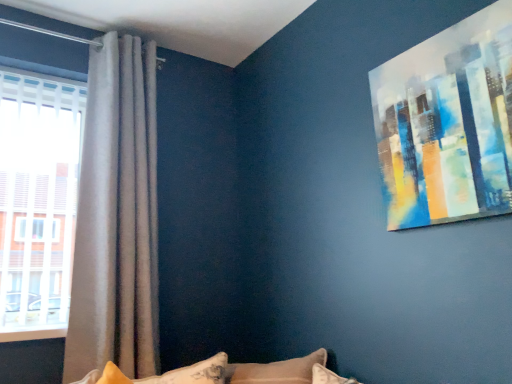
Question: Considering the relative sizes of satin grey curtain at left and fluffy white pillow at lower center in the image provided, is satin grey curtain at left shorter than fluffy white pillow at lower center?

Choices:
 (A) yes
 (B) no

Answer: (B)

Question: Does satin grey curtain at left come behind fluffy white pillow at lower center?

Choices:
 (A) yes
 (B) no

Answer: (A)

Question: From a real-world perspective, is satin grey curtain at left located beneath fluffy white pillow at lower center?

Choices:
 (A) no
 (B) yes

Answer: (A)

Question: Does satin grey curtain at left appear on the right side of fluffy white pillow at lower center?

Choices:
 (A) no
 (B) yes

Answer: (A)

Question: From the image's perspective, would you say satin grey curtain at left is shown under fluffy white pillow at lower center?

Choices:
 (A) no
 (B) yes

Answer: (A)

Question: Can fluffy white pillow at lower center be found inside satin grey curtain at left?

Choices:
 (A) no
 (B) yes

Answer: (A)

Question: Are acrylic painting at upper right and satin grey curtain at left beside each other?

Choices:
 (A) no
 (B) yes

Answer: (A)

Question: Is acrylic painting at upper right facing away from satin grey curtain at left?

Choices:
 (A) no
 (B) yes

Answer: (A)

Question: Is acrylic painting at upper right positioned beyond the bounds of satin grey curtain at left?

Choices:
 (A) no
 (B) yes

Answer: (B)

Question: Is satin grey curtain at left located within acrylic painting at upper right?

Choices:
 (A) yes
 (B) no

Answer: (B)

Question: Can you confirm if acrylic painting at upper right is positioned to the right of satin grey curtain at left?

Choices:
 (A) no
 (B) yes

Answer: (B)

Question: Would you consider acrylic painting at upper right to be distant from satin grey curtain at left?

Choices:
 (A) yes
 (B) no

Answer: (A)

Question: Is satin grey curtain at left at the left side of acrylic painting at upper right?

Choices:
 (A) no
 (B) yes

Answer: (B)